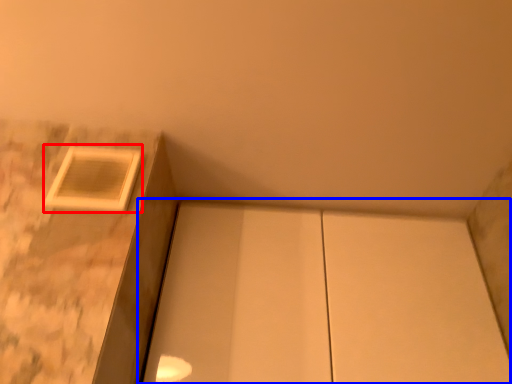
Question: Which object is further to the camera taking this photo, window (highlighted by a red box) or cabinetry (highlighted by a blue box)?

Choices:
 (A) window
 (B) cabinetry

Answer: (B)